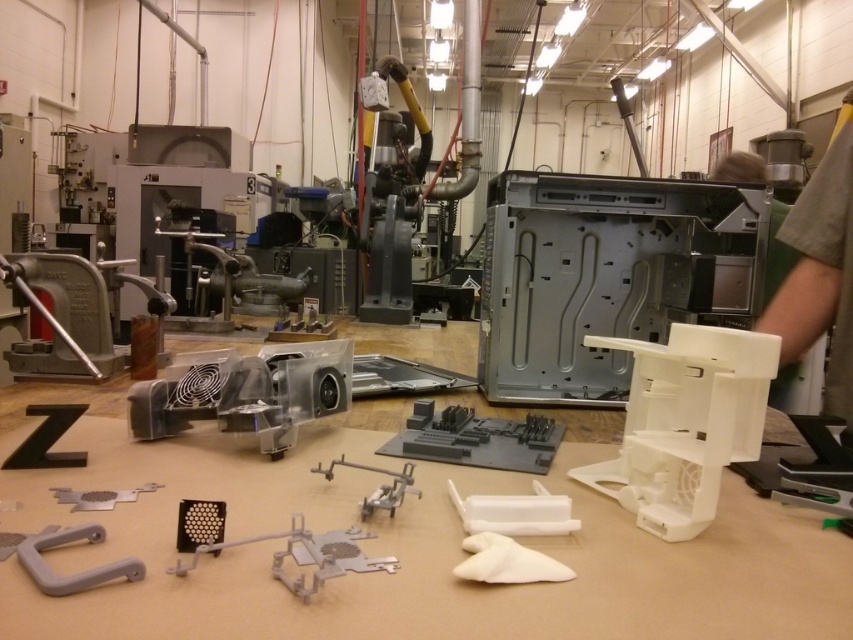
Question: Which of these objects is positioned closest to the gray matte plastic at center?

Choices:
 (A) gray matte plastic tool at center
 (B) gray matte plastic handle at lower left
 (C) metallic gray bracket at lower left
 (D) gray matte circuit board at center

Answer: (A)

Question: Is gray matte circuit board at center smaller than gray matte plastic handle at lower left?

Choices:
 (A) no
 (B) yes

Answer: (A)

Question: Can you confirm if white plastic bracket at center is positioned above gray matte plastic tool at center?

Choices:
 (A) no
 (B) yes

Answer: (B)

Question: Which object appears farthest from the camera in this image?

Choices:
 (A) gray matte plastic handle at lower left
 (B) gray matte plastic at center

Answer: (B)

Question: Does white plastic bracket at center lie behind gray matte plastic tool at center?

Choices:
 (A) no
 (B) yes

Answer: (A)

Question: Which point is closer to the camera taking this photo?

Choices:
 (A) (641, 513)
 (B) (352, 560)

Answer: (B)